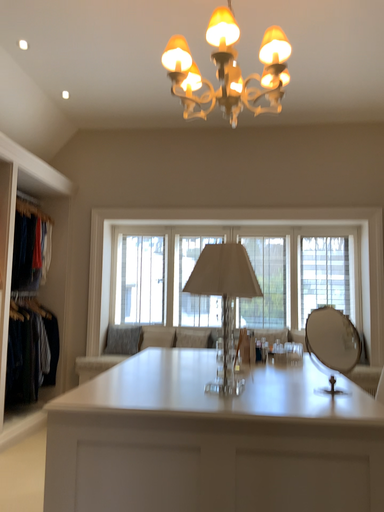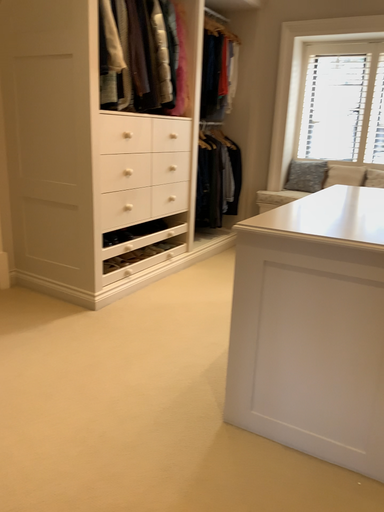
Question: How did the camera likely rotate when shooting the video?

Choices:
 (A) rotated right
 (B) rotated left

Answer: (B)